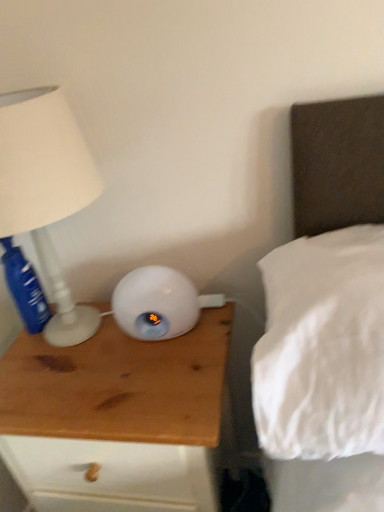
Looking at this image, what is the approximate width of white matte lamp at left?

11.37 inches.

This screenshot has height=512, width=384. What do you see at coordinates (24, 288) in the screenshot?
I see `blue plastic bottle at left` at bounding box center [24, 288].

I want to click on white soft pillow at upper right, so click(337, 164).

Could wooden nightstand at left be considered to be inside white matte lamp at left?

No, wooden nightstand at left is not surrounded by white matte lamp at left.

From the image's perspective, is white matte lamp at left beneath wooden nightstand at left?

No, from the image's perspective, white matte lamp at left is not below wooden nightstand at left.

I want to click on nightstand lying behind the white matte lamp at left, so click(x=116, y=406).

From a real-world perspective, is white matte lamp at left above or below wooden nightstand at left?

white matte lamp at left is above wooden nightstand at left.

Which point is more distant from viewer, (208,473) or (18,258)?

Positioned behind is point (208,473).

From the image's perspective, which one is positioned higher, wooden nightstand at left or blue plastic bottle at left?

From the image's view, blue plastic bottle at left is above.

You are a GUI agent. You are given a task and a screenshot of the screen. Output one action in this format:
    pyautogui.click(x=<x>, y=<y>)
    Task: Click on the nightstand in front of the blue plastic bottle at left
    Image resolution: width=384 pixels, height=512 pixels.
    Given the screenshot: What is the action you would take?
    pyautogui.click(x=116, y=406)

Visually, is wooden nightstand at left positioned to the left or to the right of blue plastic bottle at left?

From the image, it's evident that wooden nightstand at left is to the right of blue plastic bottle at left.

Does white soft pillow at upper right appear on the left side of white matte lamp at left?

No, white soft pillow at upper right is not to the left of white matte lamp at left.

Between white soft pillow at upper right and white matte lamp at left, which one is positioned in front?

white soft pillow at upper right is more forward.

Is white soft pillow at upper right inside or outside of white matte lamp at left?

white soft pillow at upper right lies outside white matte lamp at left.

Based on the photo, is white soft pillow at upper right beside white matte lamp at left?

No.

From the image's perspective, relative to white matte lamp at left, is wooden nightstand at left above or below?

wooden nightstand at left is situated lower than white matte lamp at left in the image.

From a real-world perspective, is wooden nightstand at left physically located above or below white matte lamp at left?

Clearly, from a real-world perspective, wooden nightstand at left is below white matte lamp at left.

Is wooden nightstand at left looking in the opposite direction of white matte lamp at left?

No, wooden nightstand at left is not facing away from white matte lamp at left.

At what (x,y) coordinates should I click in order to perform the action: click on nightstand below the white matte lamp at left (from a real-world perspective). Please return your answer as a coordinate pair (x, y). Looking at the image, I should click on (116, 406).

From the image's perspective, which one is positioned lower, blue plastic bottle at left or wooden nightstand at left?

wooden nightstand at left, from the image's perspective.

Is blue plastic bottle at left next to wooden nightstand at left and touching it?

There is a gap between blue plastic bottle at left and wooden nightstand at left.

Is point (10, 267) in front of point (31, 336)?

Yes, point (10, 267) is closer to viewer.

How far apart are wooden nightstand at left and white soft pillow at upper right?

wooden nightstand at left is 19.28 inches away from white soft pillow at upper right.

Between point (84, 447) and point (340, 113), which one is positioned in front?

The point (340, 113) is closer.

Which object is further away from the camera, wooden nightstand at left or white soft pillow at upper right?

wooden nightstand at left.

Is wooden nightstand at left taller than white soft pillow at upper right?

Yes, wooden nightstand at left is taller than white soft pillow at upper right.

Is white soft pillow at upper right to the left or to the right of blue plastic bottle at left in the image?

Clearly, white soft pillow at upper right is on the right of blue plastic bottle at left in the image.

Is white soft pillow at upper right oriented away from blue plastic bottle at left?

That's not correct — white soft pillow at upper right is not looking away from blue plastic bottle at left.

From the image's perspective, is white soft pillow at upper right beneath blue plastic bottle at left?

Yes.

Locate an element on the screen. Image resolution: width=384 pixels, height=512 pixels. nightstand located behind the white matte lamp at left is located at coordinates (116, 406).

Where is `bottle on the left of wooden nightstand at left`? bottle on the left of wooden nightstand at left is located at coordinates (24, 288).

When comparing their distances from blue plastic bottle at left, does wooden nightstand at left or white soft pillow at upper right seem closer?

wooden nightstand at left lies closer to blue plastic bottle at left than the other object.

Which object lies nearer to the anchor point wooden nightstand at left, blue plastic bottle at left or white matte lamp at left?

white matte lamp at left is positioned closer to the anchor wooden nightstand at left.

Which object lies further to the anchor point white soft pillow at upper right, wooden nightstand at left or blue plastic bottle at left?

blue plastic bottle at left is further to white soft pillow at upper right.

Which object lies nearer to the anchor point white soft pillow at upper right, white matte lamp at left or wooden nightstand at left?

Based on the image, white matte lamp at left appears to be nearer to white soft pillow at upper right.

Which object lies nearer to the anchor point wooden nightstand at left, white matte lamp at left or white soft pillow at upper right?

white matte lamp at left lies closer to wooden nightstand at left than the other object.

Looking at the image, which one is located closer to white soft pillow at upper right, white matte lamp at left or blue plastic bottle at left?

Among the two, white matte lamp at left is located nearer to white soft pillow at upper right.

From the image, which object appears to be farther from wooden nightstand at left, white soft pillow at upper right or white matte lamp at left?

white soft pillow at upper right.

Looking at the image, which one is located closer to blue plastic bottle at left, white soft pillow at upper right or white matte lamp at left?

Among the two, white matte lamp at left is located nearer to blue plastic bottle at left.

Find the location of a particular element. This screenshot has width=384, height=512. bed between white matte lamp at left and wooden nightstand at left in the vertical direction is located at coordinates (337, 164).

Find the location of a particular element. This screenshot has width=384, height=512. nightstand between blue plastic bottle at left and white soft pillow at upper right in the horizontal direction is located at coordinates (116, 406).

Identify the location of bottle between white matte lamp at left and wooden nightstand at left in the vertical direction. (24, 288).

Identify the location of lamp situated between blue plastic bottle at left and white soft pillow at upper right from left to right. This screenshot has height=512, width=384. (46, 191).